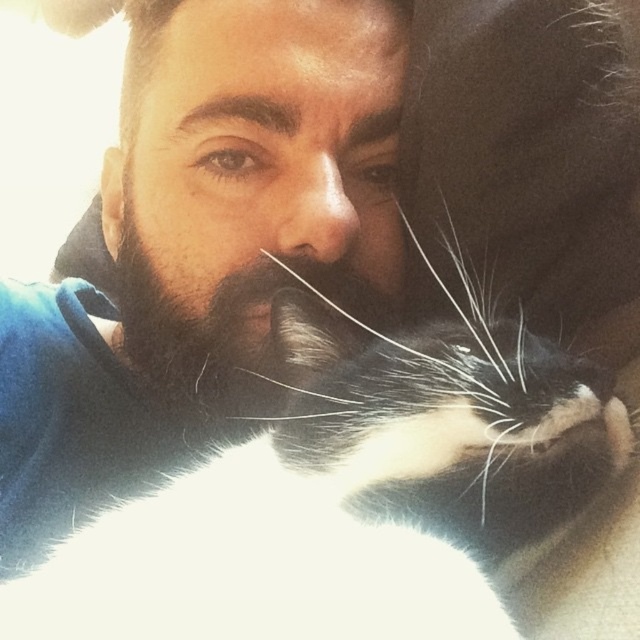
Question: Which point is closer to the camera?

Choices:
 (A) white fur cat at center
 (B) black fuzzy beard at center

Answer: (A)

Question: Is the position of white fur cat at center less distant than that of black fuzzy beard at center?

Choices:
 (A) no
 (B) yes

Answer: (B)

Question: Considering the relative positions of white fur cat at center and black fuzzy beard at center in the image provided, where is white fur cat at center located with respect to black fuzzy beard at center?

Choices:
 (A) above
 (B) below

Answer: (B)

Question: Which point is farther to the camera?

Choices:
 (A) white fur cat at center
 (B) black fuzzy beard at center

Answer: (B)

Question: Does white fur cat at center appear under black fuzzy beard at center?

Choices:
 (A) yes
 (B) no

Answer: (A)

Question: Which point appears closest to the camera in this image?

Choices:
 (A) (362, 278)
 (B) (371, 337)

Answer: (B)